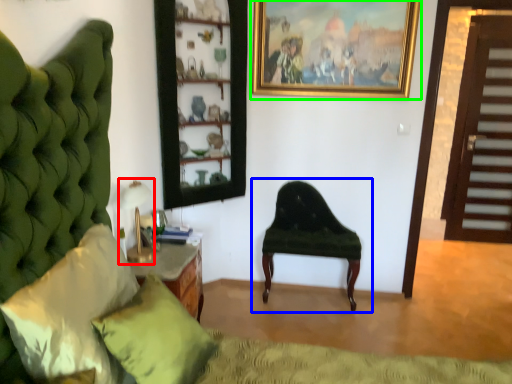
Question: Considering the real-world distances, which object is farthest from table lamp (highlighted by a red box)? chair (highlighted by a blue box) or picture frame (highlighted by a green box)?

Choices:
 (A) chair
 (B) picture frame

Answer: (B)